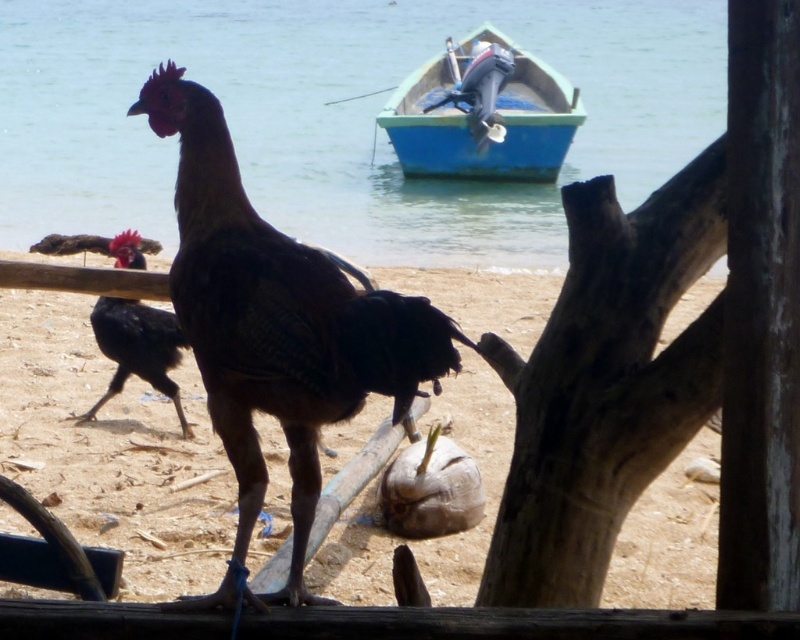
Question: Is shiny black rooster at center positioned in front of blue painted wood boat at upper center?

Choices:
 (A) no
 (B) yes

Answer: (B)

Question: Among these points, which one is farthest from the camera?

Choices:
 (A) (676, 26)
 (B) (164, 323)
 (C) (454, 161)
 (D) (38, 326)

Answer: (A)

Question: Which is nearer to the clear blue water at center?

Choices:
 (A) shiny black rooster at center
 (B) blue painted wood boat at upper center

Answer: (B)

Question: From the image, what is the correct spatial relationship of shiny black rooster at center in relation to blue painted wood boat at upper center?

Choices:
 (A) above
 (B) below

Answer: (B)

Question: Which object is the farthest from the shiny black rooster at center?

Choices:
 (A) blue painted wood boat at upper center
 (B) brown sandy beach at center
 (C) clear blue water at center
 (D) black matte chicken at center

Answer: (A)

Question: Is the position of brown sandy beach at center less distant than that of black matte chicken at center?

Choices:
 (A) no
 (B) yes

Answer: (A)